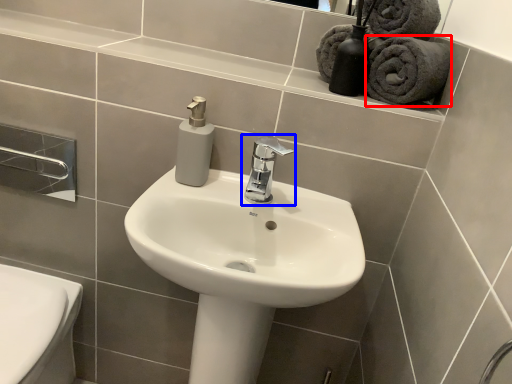
Question: Which object is closer to the camera taking this photo, bath towel (highlighted by a red box) or tap (highlighted by a blue box)?

Choices:
 (A) bath towel
 (B) tap

Answer: (B)